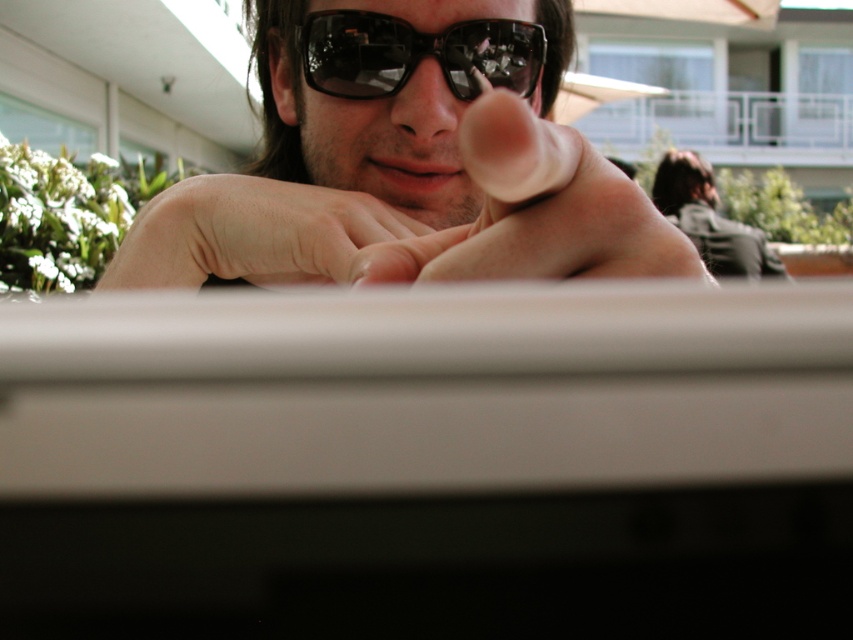
You are a photographer trying to capture the point at coordinates (535,212) on the white object in the foreground. Based on the scene description, where should you aim your camera to ensure you capture the point?

The point at coordinates (535,212) is located on the skinny flesh at center, so aim your camera toward the center of the white object in the foreground to capture it.

You are designing a display case for a sunglasses store. The display case must accommodate both the skinny flesh at center and the black reflective sunglasses at center. Since the case has a narrow compartment, which item should be placed first to ensure both fit properly?

The skinny flesh at center should be placed first in the narrow compartment because it is thinner than the black reflective sunglasses at center, allowing space for both items to fit.

Based on the photo, you are a photographer adjusting your camera settings. You notice the matte black sunglasses at center and the skinny flesh at center in the frame. Which object should you focus on to ensure the other remains in the background?

You should focus on the matte black sunglasses at center because it is in front of the skinny flesh at center, so focusing on it will keep the skinny flesh at center in the background.